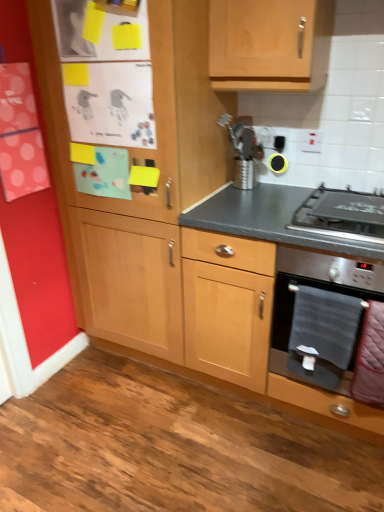
Question: Could you tell me if stainless steel gas stove at lower right is turned towards gray fabric towel at lower right, which appears as the second blanket when viewed from the right?

Choices:
 (A) yes
 (B) no

Answer: (B)

Question: Would you say gray fabric towel at lower right, which appears as the second blanket when viewed from the right, is part of stainless steel gas stove at lower right's contents?

Choices:
 (A) no
 (B) yes

Answer: (A)

Question: Can you confirm if stainless steel gas stove at lower right is taller than gray fabric towel at lower right, which appears as the second blanket when viewed from the right?

Choices:
 (A) no
 (B) yes

Answer: (A)

Question: From a real-world perspective, does stainless steel gas stove at lower right sit lower than gray fabric towel at lower right, which is counted as the first blanket, starting from the left?

Choices:
 (A) yes
 (B) no

Answer: (B)

Question: Considering the relative sizes of stainless steel gas stove at lower right and gray fabric towel at lower right, which is counted as the first blanket, starting from the left, in the image provided, is stainless steel gas stove at lower right smaller than gray fabric towel at lower right, which is counted as the first blanket, starting from the left,?

Choices:
 (A) yes
 (B) no

Answer: (A)

Question: From a real-world perspective, is black rubber earbud at upper center physically located above or below stainless steel gas stove at lower right?

Choices:
 (A) below
 (B) above

Answer: (B)

Question: Looking at the image, does black rubber earbud at upper center seem bigger or smaller compared to stainless steel gas stove at lower right?

Choices:
 (A) big
 (B) small

Answer: (B)

Question: In terms of width, does black rubber earbud at upper center look wider or thinner when compared to stainless steel gas stove at lower right?

Choices:
 (A) wide
 (B) thin

Answer: (B)

Question: Considering the positions of point (279, 156) and point (307, 206), is point (279, 156) closer or farther from the camera than point (307, 206)?

Choices:
 (A) farther
 (B) closer

Answer: (A)

Question: From a real-world perspective, is gray fabric towel at lower right, which is counted as the first blanket, starting from the left, physically located above or below velvet pink blanket at lower right, which is counted as the first blanket, starting from the right?

Choices:
 (A) below
 (B) above

Answer: (B)

Question: In the image, is gray fabric towel at lower right, which appears as the second blanket when viewed from the right, on the left side or the right side of velvet pink blanket at lower right, the 2th blanket positioned from the left?

Choices:
 (A) right
 (B) left

Answer: (B)

Question: Is gray fabric towel at lower right, which is counted as the first blanket, starting from the left, taller or shorter than velvet pink blanket at lower right, the 2th blanket positioned from the left?

Choices:
 (A) short
 (B) tall

Answer: (B)

Question: Looking at their shapes, would you say gray fabric towel at lower right, which is counted as the first blanket, starting from the left, is wider or thinner than velvet pink blanket at lower right, which is counted as the first blanket, starting from the right?

Choices:
 (A) wide
 (B) thin

Answer: (A)

Question: From a real-world perspective, relative to black rubber earbud at upper center, is stainless steel oven at lower right vertically above or below?

Choices:
 (A) above
 (B) below

Answer: (B)

Question: Considering the positions of stainless steel oven at lower right and black rubber earbud at upper center in the image, is stainless steel oven at lower right wider or thinner than black rubber earbud at upper center?

Choices:
 (A) wide
 (B) thin

Answer: (A)